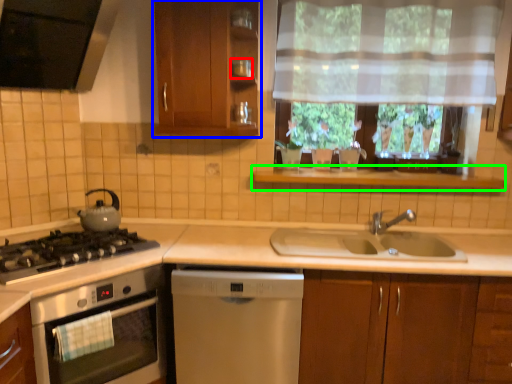
Question: Which object is the farthest from appliance (highlighted by a red box)? Choose among these: cabinetry (highlighted by a blue box) or window sill (highlighted by a green box).

Choices:
 (A) cabinetry
 (B) window sill

Answer: (B)